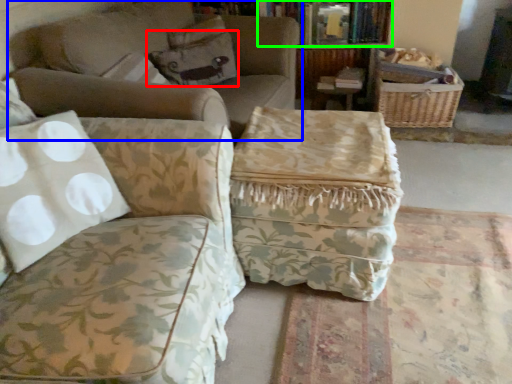
Question: Estimate the real-world distances between objects in this image. Which object is farther from pillow (highlighted by a red box), studio couch (highlighted by a blue box) or book (highlighted by a green box)?

Choices:
 (A) studio couch
 (B) book

Answer: (B)